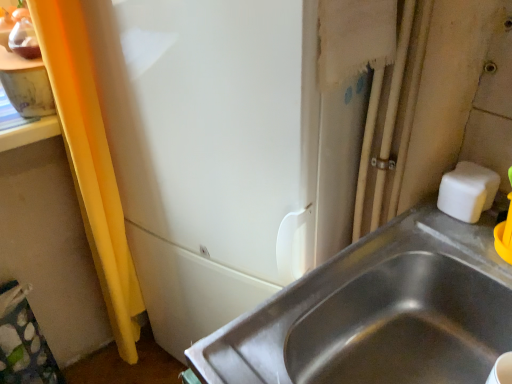
Question: From the image's perspective, is stainless steel sink at lower right above or below white matte soap at upper right?

Choices:
 (A) above
 (B) below

Answer: (B)

Question: Is point (487, 307) closer or farther from the camera than point (477, 163)?

Choices:
 (A) farther
 (B) closer

Answer: (B)

Question: Considering the relative positions of stainless steel sink at lower right and white matte soap at upper right in the image provided, is stainless steel sink at lower right to the left or to the right of white matte soap at upper right?

Choices:
 (A) right
 (B) left

Answer: (B)

Question: From their relative heights in the image, would you say white matte soap at upper right is taller or shorter than stainless steel sink at lower right?

Choices:
 (A) short
 (B) tall

Answer: (A)

Question: From a real-world perspective, is white matte soap at upper right physically located above or below stainless steel sink at lower right?

Choices:
 (A) above
 (B) below

Answer: (A)

Question: Considering the relative positions of white matte soap at upper right and stainless steel sink at lower right in the image provided, is white matte soap at upper right to the left or to the right of stainless steel sink at lower right?

Choices:
 (A) left
 (B) right

Answer: (B)

Question: Considering their positions, is white matte soap at upper right located in front of or behind stainless steel sink at lower right?

Choices:
 (A) behind
 (B) front

Answer: (A)